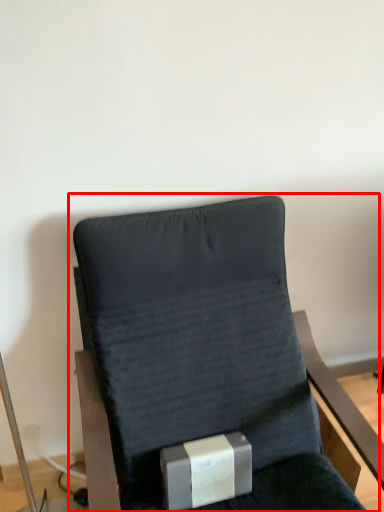
Question: From the image's perspective, where is chair (annotated by the red box) located in relation to box in the image?

Choices:
 (A) above
 (B) below

Answer: (A)